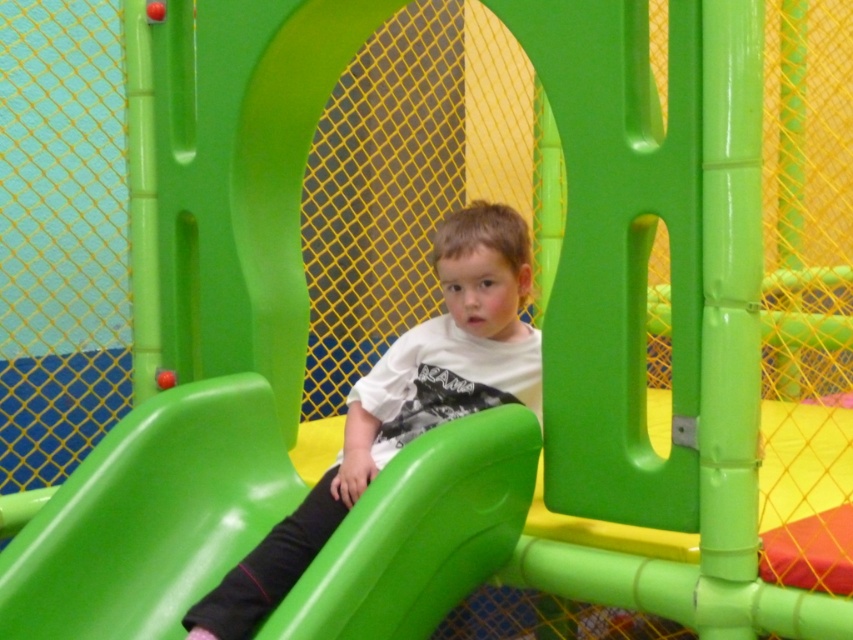
Question: Is green glossy slide at center closer to the viewer compared to matte white shirt at center?

Choices:
 (A) yes
 (B) no

Answer: (B)

Question: Does green glossy slide at center appear on the left side of matte white shirt at center?

Choices:
 (A) yes
 (B) no

Answer: (A)

Question: Can you confirm if green glossy slide at center is smaller than matte white shirt at center?

Choices:
 (A) yes
 (B) no

Answer: (A)

Question: Which object appears closest to the camera in this image?

Choices:
 (A) matte white shirt at center
 (B) green glossy slide at center

Answer: (A)

Question: Which point is closer to the camera taking this photo?

Choices:
 (A) (283, 611)
 (B) (467, 244)

Answer: (A)